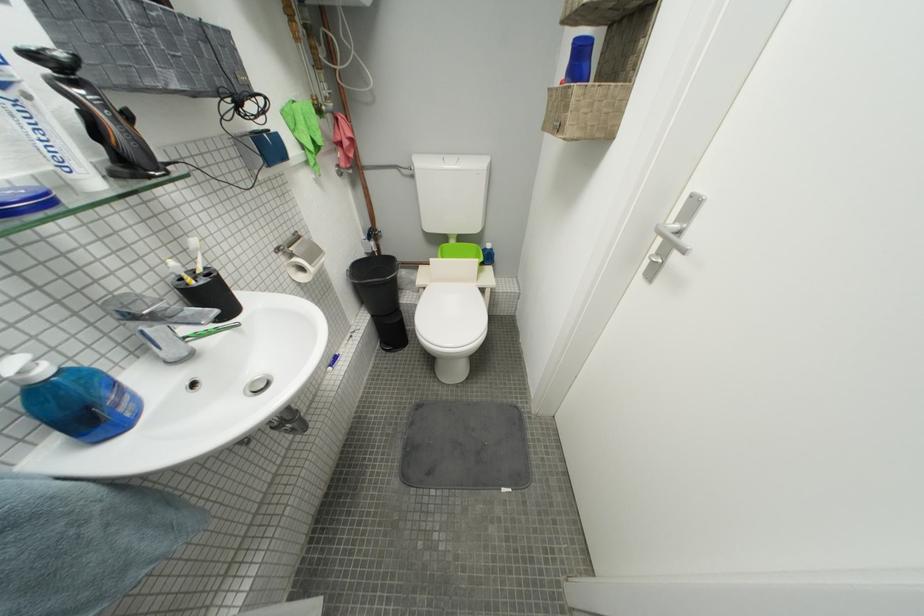
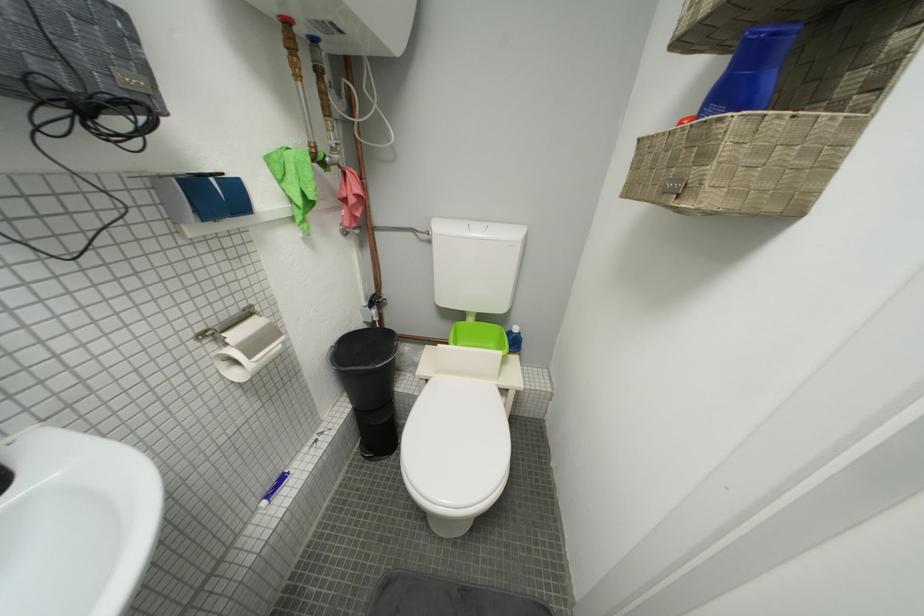
Question: The images are taken continuously from a first-person perspective. In which direction is your viewpoint rotating?

Choices:
 (A) Left
 (B) Right
 (C) Up
 (D) Down

Answer: (C)